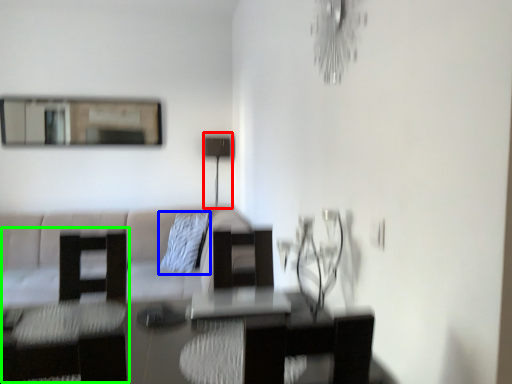
Question: Which object is positioned farthest from lamp (highlighted by a red box)? Select from pillow (highlighted by a blue box) and swivel chair (highlighted by a green box).

Choices:
 (A) pillow
 (B) swivel chair

Answer: (B)